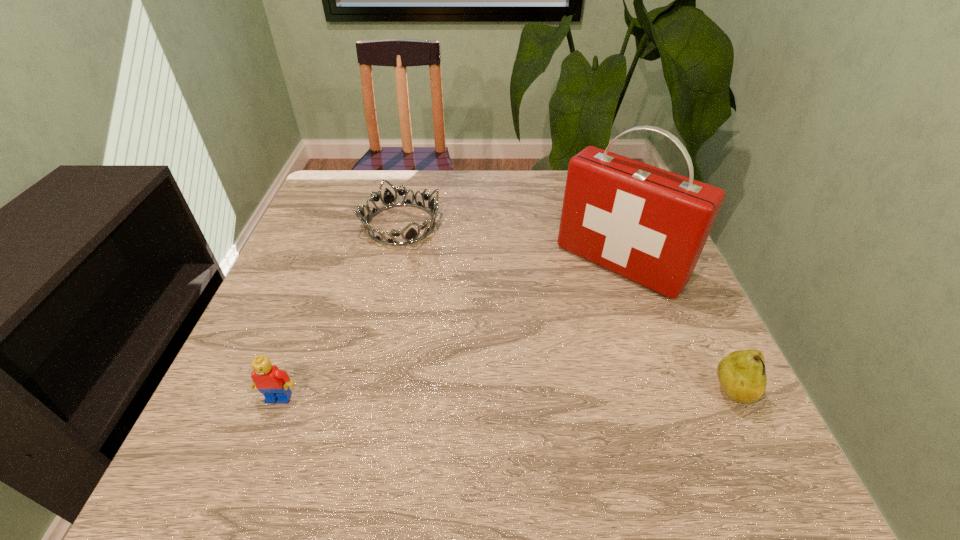
The image size is (960, 540). Identify the location of free spot between the pear and the second object from left to right. coord(566,309).

Where is `vacant space in between the leftmost object and the shortest object`? Image resolution: width=960 pixels, height=540 pixels. vacant space in between the leftmost object and the shortest object is located at coordinates (340, 311).

Identify the location of free spot between the tallest object and the pear. The image size is (960, 540). (676, 329).

The width and height of the screenshot is (960, 540). I want to click on free space between the pear and the Lego, so [x=506, y=395].

Identify the location of empty space between the shortest object and the tallest object. (510, 245).

At what (x,y) coordinates should I click in order to perform the action: click on vacant area that lies between the pear and the tiara. Please return your answer as a coordinate pair (x, y). The height and width of the screenshot is (540, 960). Looking at the image, I should click on (566, 309).

Find the location of `the closest object relative to the first-aid kit`. the closest object relative to the first-aid kit is located at coordinates (742, 374).

I want to click on object that stands as the third closest to the first-aid kit, so click(273, 383).

Where is `vacant space that satisfies the following two spatial constraints: 1. on the front side of the first-aid kit; 2. on the left side of the tiara`? The image size is (960, 540). vacant space that satisfies the following two spatial constraints: 1. on the front side of the first-aid kit; 2. on the left side of the tiara is located at coordinates (392, 264).